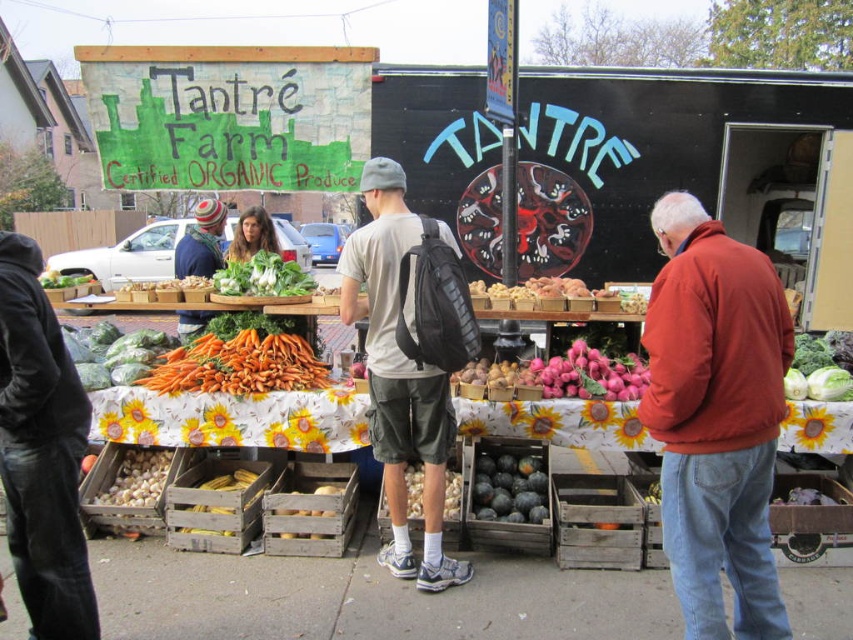
Does white matte garlic at lower left have a smaller size compared to smooth brown potato at center?

No, white matte garlic at lower left is not smaller than smooth brown potato at center.

Locate an element on the screen. The height and width of the screenshot is (640, 853). white matte garlic at lower left is located at coordinates (136, 477).

Can you confirm if gray fabric backpack at center is positioned to the right of smooth wooden crate of potatoes at center?

Indeed, gray fabric backpack at center is positioned on the right side of smooth wooden crate of potatoes at center.

The height and width of the screenshot is (640, 853). Identify the location of gray fabric backpack at center. (399, 376).

The height and width of the screenshot is (640, 853). I want to click on orange matte carrots at center, so click(239, 365).

Is point (219, 365) farther from camera compared to point (329, 486)?

That is True.

Which is behind, point (173, 381) or point (267, 522)?

Point (173, 381)

Locate an element on the screen. orange matte carrots at center is located at coordinates (239, 365).